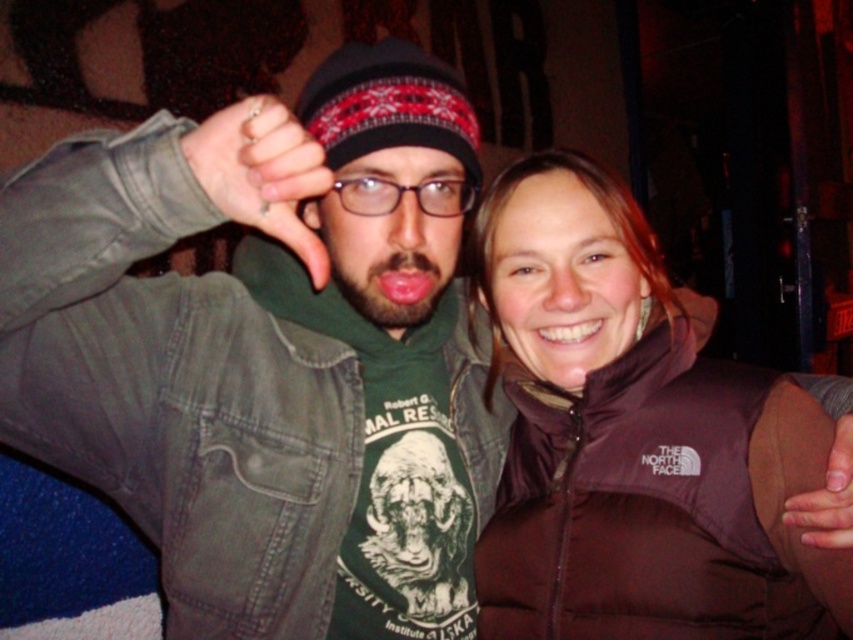
Question: Which of the following is the closest to the observer?

Choices:
 (A) (300, 104)
 (B) (287, 228)
 (C) (718, 518)
 (D) (817, 522)

Answer: (B)

Question: Does sweater knit beanie at center have a greater width compared to brown leather hand at lower right?

Choices:
 (A) no
 (B) yes

Answer: (B)

Question: Which of the following is the closest to the observer?

Choices:
 (A) matte black thumb at center
 (B) sweater knit beanie at center
 (C) brown leather hand at lower right
 (D) brown down jacket at center

Answer: (A)

Question: Does sweater knit beanie at center lie behind matte black thumb at center?

Choices:
 (A) no
 (B) yes

Answer: (B)

Question: Is sweater knit beanie at center to the left of matte black thumb at center from the viewer's perspective?

Choices:
 (A) yes
 (B) no

Answer: (B)

Question: Among these points, which one is nearest to the camera?

Choices:
 (A) (335, 74)
 (B) (753, 403)
 (C) (227, 212)
 (D) (786, 513)

Answer: (C)